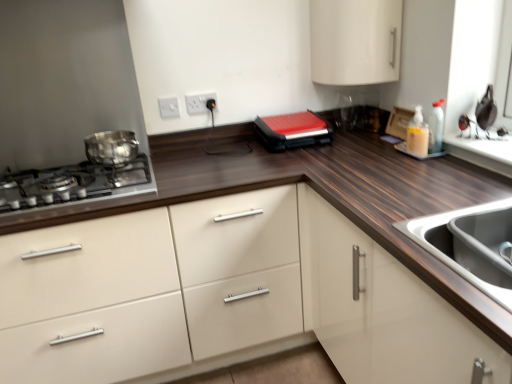
Question: From a real-world perspective, is translucent plastic soap dispenser at upper right physically above shiny metallic pot at left?

Choices:
 (A) yes
 (B) no

Answer: (B)

Question: Would you say shiny metallic pot at left is part of translucent plastic soap dispenser at upper right's contents?

Choices:
 (A) yes
 (B) no

Answer: (B)

Question: Is translucent plastic soap dispenser at upper right facing away from shiny metallic pot at left?

Choices:
 (A) yes
 (B) no

Answer: (B)

Question: Is translucent plastic soap dispenser at upper right positioned before shiny metallic pot at left?

Choices:
 (A) no
 (B) yes

Answer: (B)

Question: From a real-world perspective, is translucent plastic soap dispenser at upper right under shiny metallic pot at left?

Choices:
 (A) no
 (B) yes

Answer: (B)

Question: From a real-world perspective, is white glossy cabinet at upper center, placed as the 2th cabinetry when sorted from bottom to top, physically located above or below shiny metallic gas stove at left?

Choices:
 (A) below
 (B) above

Answer: (B)

Question: Looking at their shapes, would you say white glossy cabinet at upper center, arranged as the 1th cabinetry when viewed from the top, is wider or thinner than shiny metallic gas stove at left?

Choices:
 (A) wide
 (B) thin

Answer: (B)

Question: Considering their positions, is white glossy cabinet at upper center, arranged as the 1th cabinetry when viewed from the top, located in front of or behind shiny metallic gas stove at left?

Choices:
 (A) behind
 (B) front

Answer: (A)

Question: Based on their positions, is white glossy cabinet at upper center, placed as the 2th cabinetry when sorted from bottom to top, located to the left or right of shiny metallic gas stove at left?

Choices:
 (A) left
 (B) right

Answer: (B)

Question: Is shiny metallic pot at left bigger or smaller than white plastic electric outlet at upper center, the second electric outlet when ordered from left to right?

Choices:
 (A) small
 (B) big

Answer: (B)

Question: From the image's perspective, is shiny metallic pot at left located above or below white plastic electric outlet at upper center, which is counted as the 1th electric outlet, starting from the right?

Choices:
 (A) above
 (B) below

Answer: (B)

Question: Choose the correct answer: Is shiny metallic pot at left inside white plastic electric outlet at upper center, the second electric outlet when ordered from left to right, or outside it?

Choices:
 (A) outside
 (B) inside

Answer: (A)

Question: Is point pos(94,147) closer or farther from the camera than point pos(206,104)?

Choices:
 (A) closer
 (B) farther

Answer: (A)

Question: Do you think white glossy cabinet at upper center, placed as the 2th cabinetry when sorted from bottom to top, is within stainless steel sink at lower right, or outside of it?

Choices:
 (A) outside
 (B) inside

Answer: (A)

Question: Would you say white glossy cabinet at upper center, placed as the 2th cabinetry when sorted from bottom to top, is to the left or to the right of stainless steel sink at lower right in the picture?

Choices:
 (A) right
 (B) left

Answer: (B)